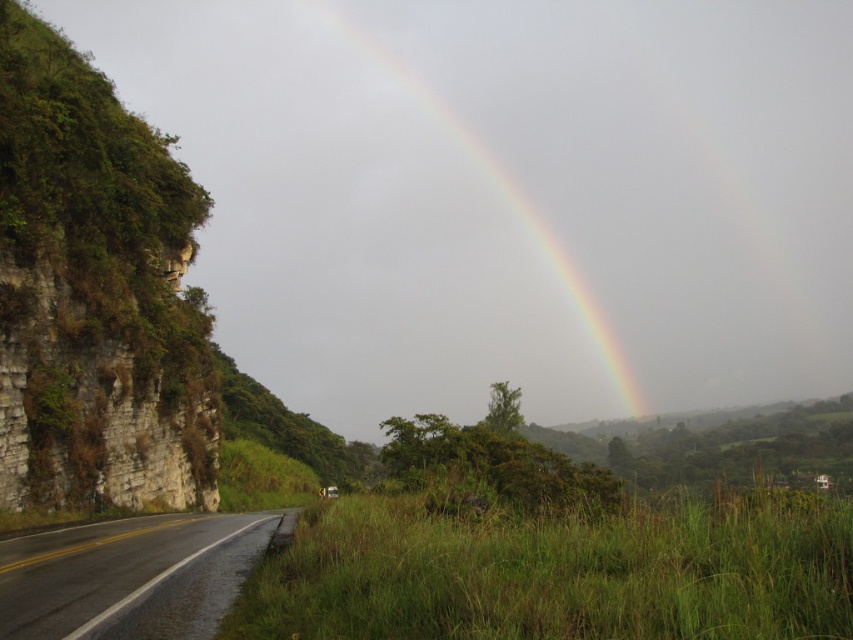
You are a hiker standing on the road in the image. You want to take a photo of the rainbow at upper center without the rocky cliff at left appearing in the frame. Is it possible to do so by adjusting your position along the road?

The rocky cliff at left is below the rainbow at upper center, so if you move to the right side of the road away from the cliff, you can position yourself where the cliff is no longer in the camera frame while keeping the rainbow visible in the sky above.